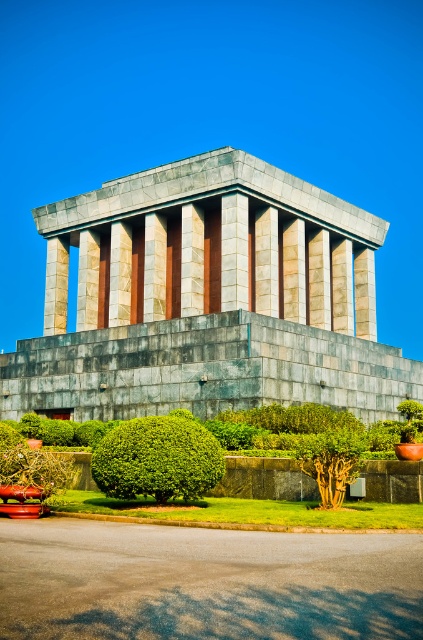
Based on the scene description, can you determine the relative positions of the gray stone temple at center and the green leafy bush at center? Specifically, which one is positioned to the right?

The gray stone temple at center is to the right of the green leafy bush at center.

You are standing in the garden area in front of the monument. There is a gray stone temple at center. Where is the point located at coordinates (208,298)?

The point at coordinates (208,298) is on the gray stone temple at center.